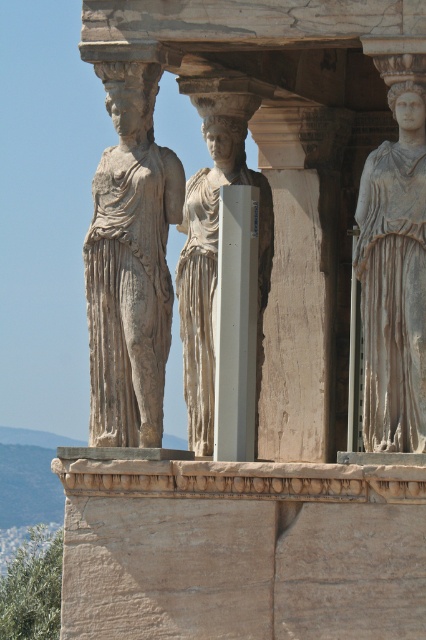
Question: Is the position of gray stone statue at center less distant than that of white smooth pillar at center?

Choices:
 (A) no
 (B) yes

Answer: (B)

Question: Which point is closer to the camera?

Choices:
 (A) (166, 268)
 (B) (226, 307)
 (C) (394, 291)

Answer: (C)

Question: Estimate the real-world distances between objects in this image. Which object is closer to the gray stone statue at left?

Choices:
 (A) white marble statue at center
 (B) white smooth pillar at center

Answer: (B)

Question: Is white marble statue at center bigger than white smooth pillar at center?

Choices:
 (A) yes
 (B) no

Answer: (A)

Question: Observing the image, what is the correct spatial positioning of gray stone statue at center in reference to white smooth pillar at center?

Choices:
 (A) left
 (B) right

Answer: (B)

Question: Which object is positioned farthest from the gray stone statue at center?

Choices:
 (A) white smooth pillar at center
 (B) gray stone statue at left

Answer: (B)